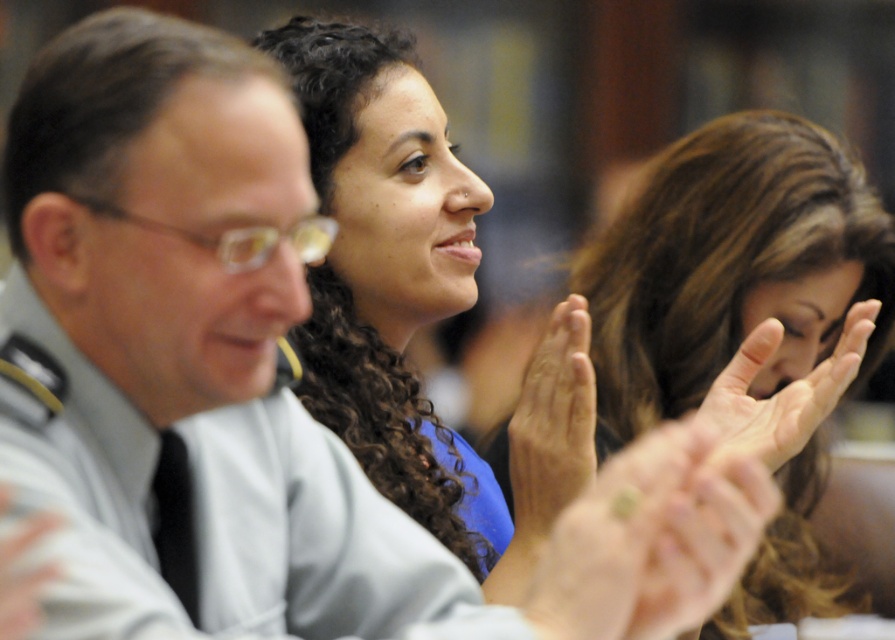
Between dry skin at center and white matte hand at center, which one appears on the right side from the viewer's perspective?

From the viewer's perspective, dry skin at center appears more on the right side.

Does point (570, 486) come farther from viewer compared to point (9, 550)?

That is True.

At what (x,y) coordinates should I click in order to perform the action: click on dry skin at center. Please return your answer as a coordinate pair (x, y). Looking at the image, I should click on (553, 420).

Identify the location of dry skin at center. (553, 420).

Does point (262, 570) lie behind point (868, 282)?

That is False.

Which is behind, point (117, 470) or point (676, 298)?

The point (676, 298) is behind.

Does point (334, 616) come closer to viewer compared to point (807, 467)?

That is True.

Locate an element on the screen. The image size is (895, 640). gray uniform at center is located at coordinates (217, 515).

Does smooth brown hair at center come behind white matte hand at center?

That is True.

You are a GUI agent. You are given a task and a screenshot of the screen. Output one action in this format:
    pyautogui.click(x=<x>, y=<y>)
    Task: Click on the smooth brown hair at center
    This screenshot has height=640, width=895.
    Given the screenshot: What is the action you would take?
    pyautogui.click(x=730, y=266)

Is point (849, 232) more distant than point (22, 628)?

Yes, it is.

Locate an element on the screen. smooth brown hair at center is located at coordinates (730, 266).